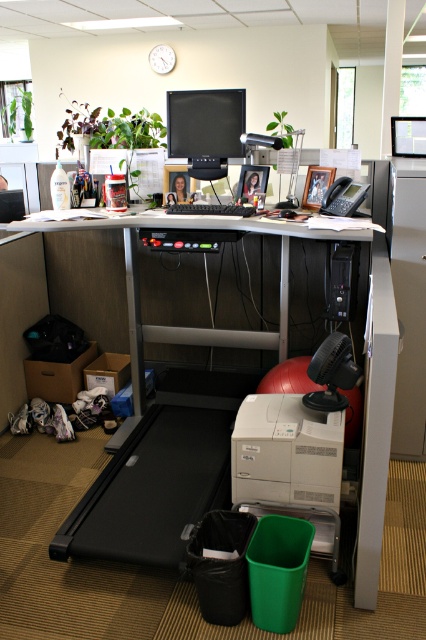
Question: Is matte gray printer at lower center above matte black telephone at right?

Choices:
 (A) no
 (B) yes

Answer: (A)

Question: Which point appears farthest from the camera in this image?

Choices:
 (A) coord(296,445)
 (B) coord(356,205)
 (C) coord(175,208)

Answer: (C)

Question: Is white plastic file cabinet at right further to the viewer compared to matte black monitor at upper center?

Choices:
 (A) no
 (B) yes

Answer: (A)

Question: Estimate the real-world distances between objects in this image. Which object is farther from the matte black telephone at right?

Choices:
 (A) white plastic file cabinet at right
 (B) matte gray printer at lower center
 (C) black plastic keyboard at center
 (D) matte black monitor at upper center

Answer: (B)

Question: Does white plastic file cabinet at right appear on the left side of matte black monitor at upper center?

Choices:
 (A) no
 (B) yes

Answer: (A)

Question: Which of these objects is positioned farthest from the white plastic file cabinet at right?

Choices:
 (A) black plastic keyboard at center
 (B) matte black monitor at upper center
 (C) matte black telephone at right
 (D) matte gray printer at lower center

Answer: (B)